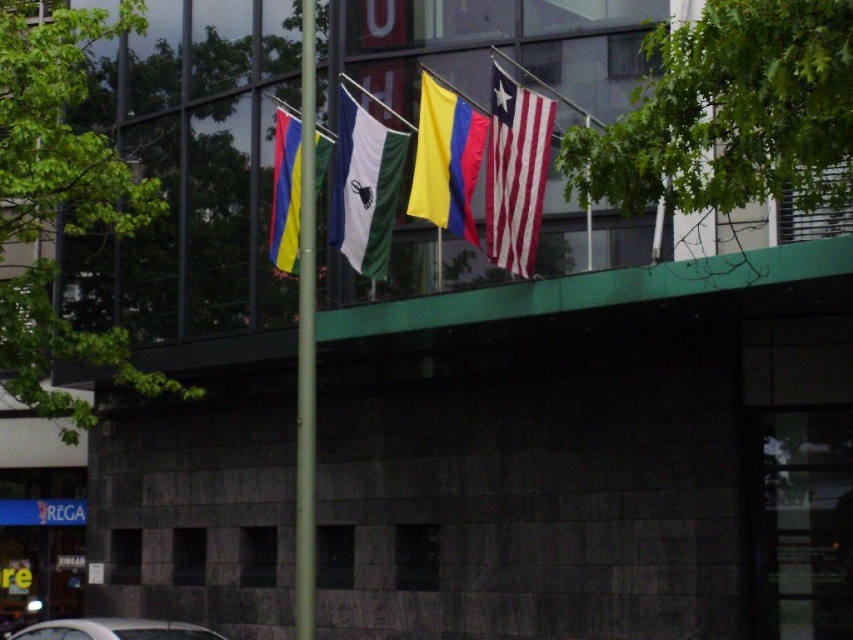
You are standing in front of the modern building and want to hang a new flag that is 3 meters tall. The white matte flag at center and the multicolored fabric flag at center are already present. Which existing flag can accommodate your new flag in terms of height without needing adjustments?

The white matte flag at center is much taller than the multicolored fabric flag at center, so the new flag can be accommodated by the white matte flag at center since it has sufficient height.

You are a photographer trying to capture both the white matte flag at center and the yellow fabric flag at center in a single shot. Which flag will occupy more space in the photo?

The white matte flag at center will occupy more space in the photo because its width is larger than the yellow fabric flag at center.

You are standing at a point 43.16 feet away from the building shown in the image. If you look towards the building, where would the point at coordinates point (340, 198) be located relative to your position?

The point at coordinates point (340, 198) is located 43.16 feet away from your position, directly towards the building.